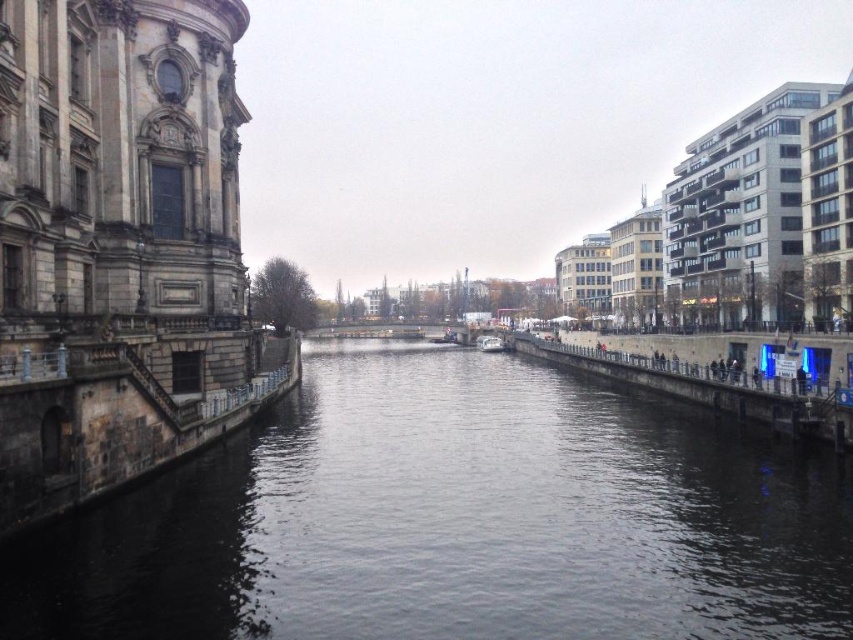
Is dark water at center taller than white plastic boat at center?

Yes, dark water at center is taller than white plastic boat at center.

How much distance is there between dark water at center and white plastic boat at center?

459.91 feet

Between point (747, 454) and point (498, 342), which one is positioned in front?

Point (747, 454) is more forward.

Where is `dark water at center`? This screenshot has width=853, height=640. dark water at center is located at coordinates (454, 518).